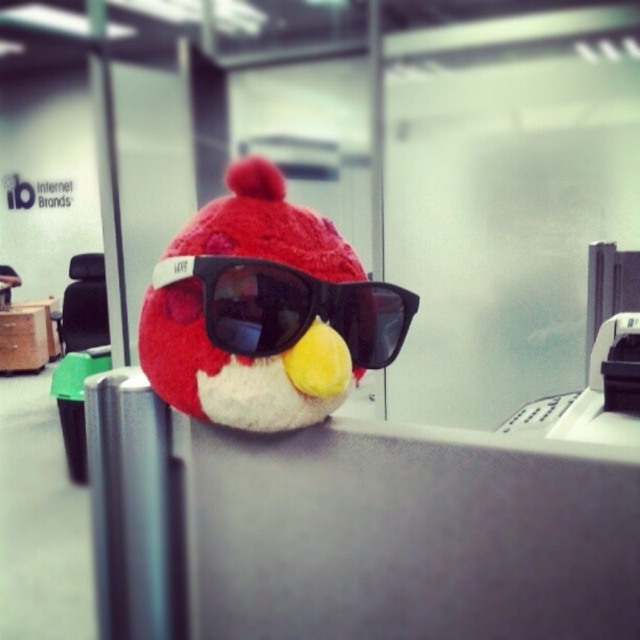
Between matte plush toy at center and black matte sunglasses at center, which one is positioned higher?

matte plush toy at center is above.

Can you confirm if matte plush toy at center is wider than black matte sunglasses at center?

Yes, matte plush toy at center is wider than black matte sunglasses at center.

Locate an element on the screen. This screenshot has height=640, width=640. matte plush toy at center is located at coordinates (264, 310).

Identify the location of matte plush toy at center. (264, 310).